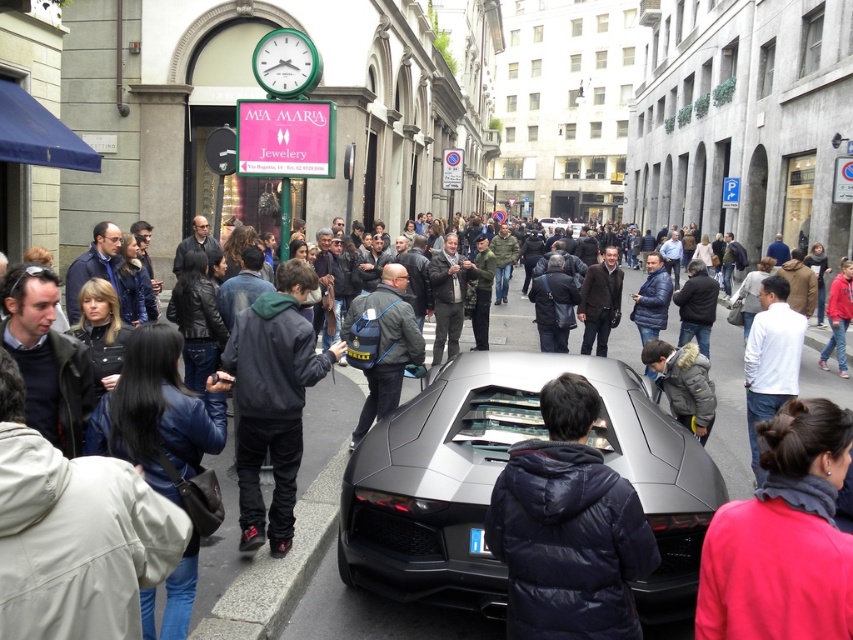
Question: Can you confirm if dark blue puffer jacket at center is wider than dark gray backpack at center?

Choices:
 (A) no
 (B) yes

Answer: (A)

Question: Which object is closer to the camera taking this photo?

Choices:
 (A) red fleece jacket at center
 (B) dark blue puffer jacket at center

Answer: (A)

Question: Is dark gray backpack at center thinner than white matte shirt at center?

Choices:
 (A) no
 (B) yes

Answer: (A)

Question: Which is nearer to the dark blue leather jacket at center?

Choices:
 (A) red fleece jacket at center
 (B) matt metallic sports car at center
 (C) dark gray backpack at center
 (D) white matte shirt at center

Answer: (B)

Question: Does matt metallic sports car at center appear on the right side of gray down jacket at center?

Choices:
 (A) yes
 (B) no

Answer: (B)

Question: Among these objects, which one is farthest from the camera?

Choices:
 (A) dark blue leather jacket at center
 (B) matte black jacket at center

Answer: (B)